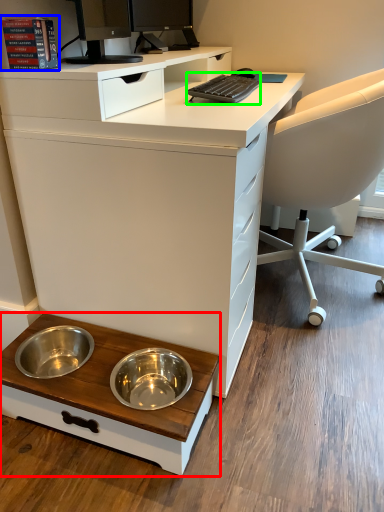
Question: Based on their relative distances, which object is farther from table (highlighted by a red box)? Choose from book (highlighted by a blue box) and computer keyboard (highlighted by a green box).

Choices:
 (A) book
 (B) computer keyboard

Answer: (B)